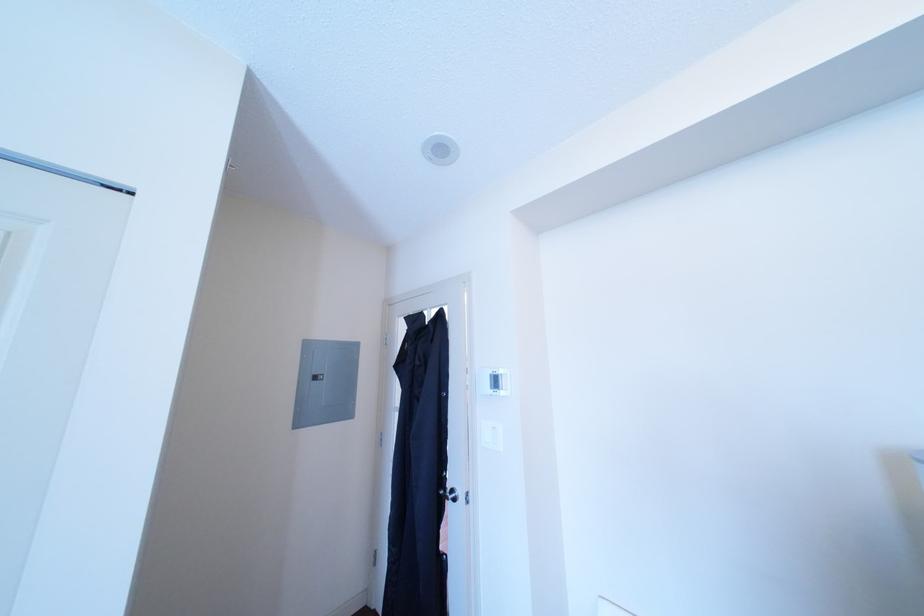
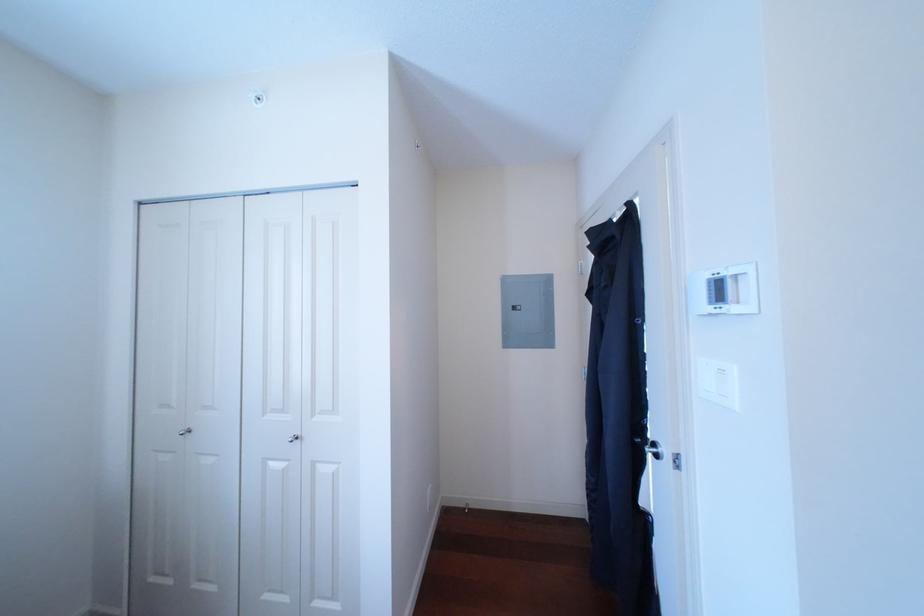
Question: The camera is either moving clockwise (left) or counter-clockwise (right) around the object. The first image is from the beginning of the video and the second image is from the end. Is the camera moving left or right when shooting the video?

Choices:
 (A) Left
 (B) Right

Answer: (B)